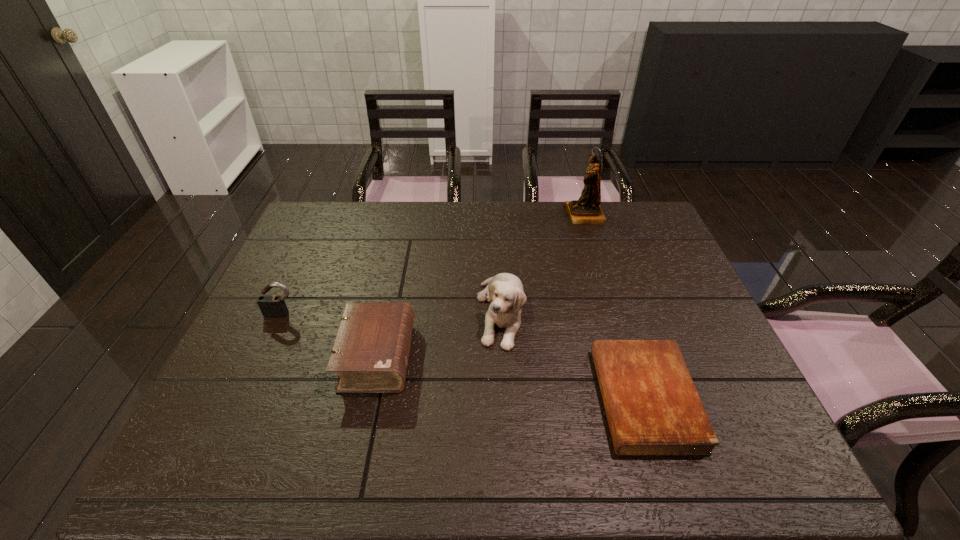
You are a GUI agent. You are given a task and a screenshot of the screen. Output one action in this format:
    pyautogui.click(x=<x>, y=<y>)
    Task: Click on the object that is positioned at the near edge
    The image size is (960, 540).
    Given the screenshot: What is the action you would take?
    pyautogui.click(x=652, y=406)

Find the location of `object that is at the left edge`. object that is at the left edge is located at coordinates (272, 306).

Where is `object situated at the right edge`? The height and width of the screenshot is (540, 960). object situated at the right edge is located at coordinates (652, 406).

Image resolution: width=960 pixels, height=540 pixels. Identify the location of object positioned at the near right corner. (652, 406).

Locate an element on the screen. The image size is (960, 540). vacant space at the far edge of the desktop is located at coordinates (430, 218).

The width and height of the screenshot is (960, 540). Identify the location of vacant space at the near edge of the desktop. (594, 451).

This screenshot has width=960, height=540. I want to click on vacant space at the left edge, so click(288, 245).

The image size is (960, 540). What are the coordinates of `vacant space at the right edge of the desktop` in the screenshot? It's located at (739, 417).

Where is `blank space at the near right corner of the desktop`? Image resolution: width=960 pixels, height=540 pixels. blank space at the near right corner of the desktop is located at coordinates (764, 463).

The image size is (960, 540). Find the location of `free space between the tallest object and the third shortest object`. free space between the tallest object and the third shortest object is located at coordinates (433, 265).